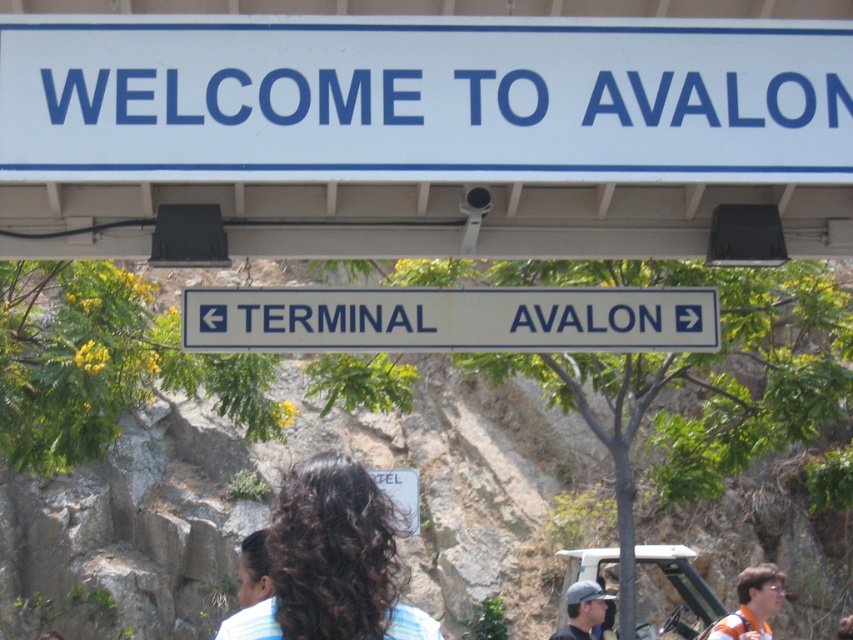
You are a tour guide leading a group to the terminal. You see the white plastic sign at upper center and the white plastic sign at center. How far apart are these two signs?

The distance between the white plastic sign at upper center and the white plastic sign at center is 3.06 meters.

You are standing at the entrance and see the orange fabric shirt at lower right and the dark brown hair at center. Which object is positioned lower in the scene?

The orange fabric shirt at lower right is located below dark brown hair at center, so the orange fabric shirt at lower right is positioned lower in the scene.

You are standing at the entrance and see the dark brown curly hair at center. Where exactly is it located in terms of coordinates?

The dark brown curly hair at center is located at point [332,561].